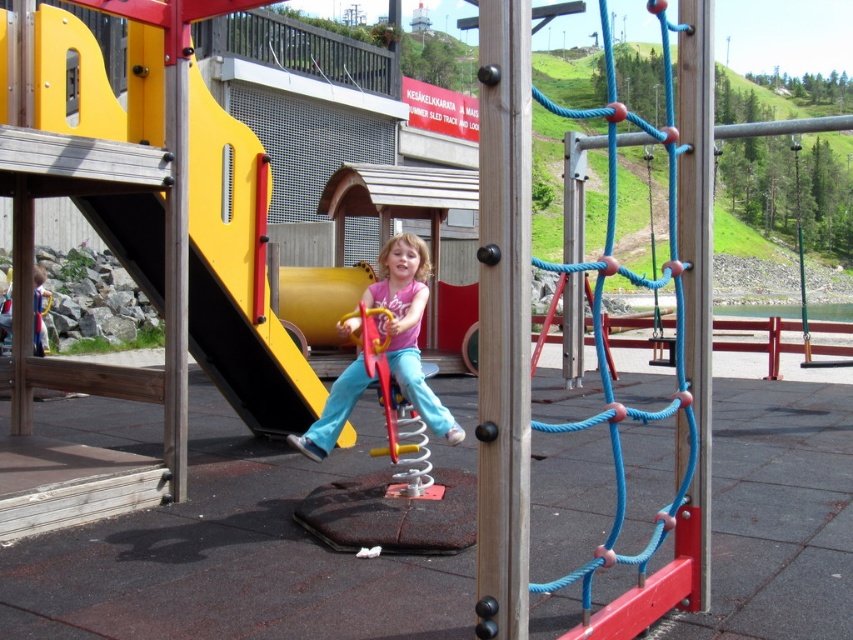
Which of these two, blue rope swing at center right or pink matte shirt at center, stands shorter?

pink matte shirt at center

Who is positioned more to the left, blue rope swing at center right or pink matte shirt at center?

pink matte shirt at center

Is point (679, 496) less distant than point (341, 324)?

Yes, point (679, 496) is closer to viewer.

At what (x,y) coordinates should I click in order to perform the action: click on blue rope swing at center right. Please return your answer as a coordinate pair (x, y). This screenshot has height=640, width=853. Looking at the image, I should click on (606, 337).